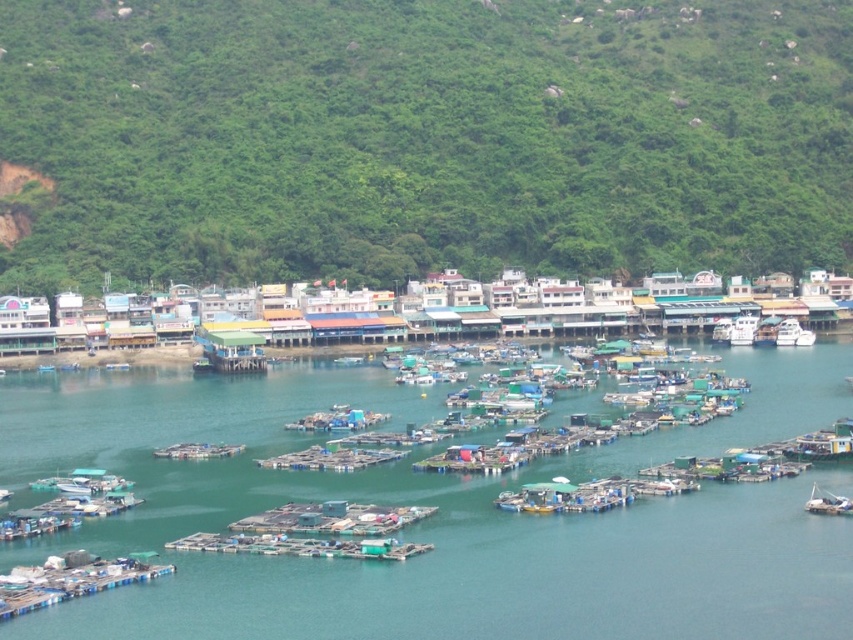
Does green leafy hillside at upper center appear on the right side of green plastic boats at center?

Indeed, green leafy hillside at upper center is positioned on the right side of green plastic boats at center.

Does point (608, 148) come behind point (175, 456)?

That is True.

I want to click on green leafy hillside at upper center, so click(x=422, y=138).

Is the position of green leafy hillside at upper center less distant than that of white glossy boat at center-right?

No, it is not.

Can you confirm if green leafy hillside at upper center is positioned above white glossy boat at center-right?

Indeed, green leafy hillside at upper center is positioned over white glossy boat at center-right.

Does point (830, 218) lie in front of point (811, 332)?

No, it is behind (811, 332).

Find the location of a particular element. The image size is (853, 640). green leafy hillside at upper center is located at coordinates (422, 138).

Does green water at center appear over green plastic boats at center?

Yes, green water at center is above green plastic boats at center.

Does green water at center come in front of green plastic boats at center?

That is True.

Find the location of a particular element. green water at center is located at coordinates (436, 518).